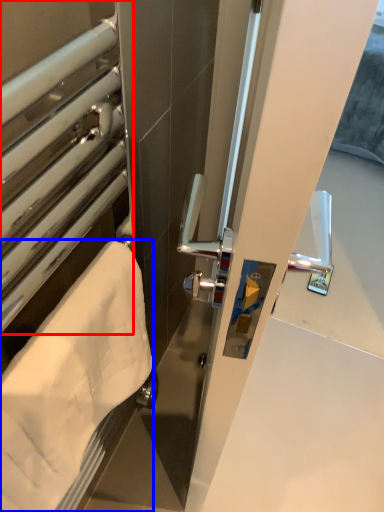
Question: Which point is further to the camera, window (highlighted by a red box) or towel (highlighted by a blue box)?

Choices:
 (A) window
 (B) towel

Answer: (B)